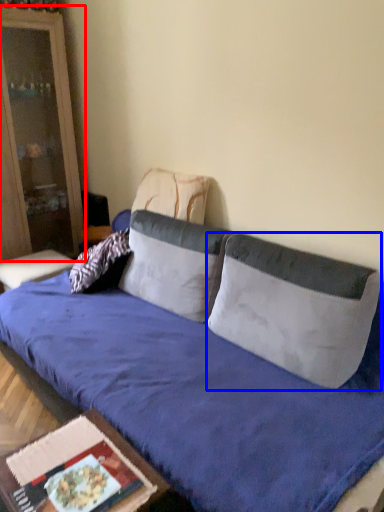
Question: Which point is closer to the camera, cabinetry (highlighted by a red box) or pillow (highlighted by a blue box)?

Choices:
 (A) cabinetry
 (B) pillow

Answer: (B)